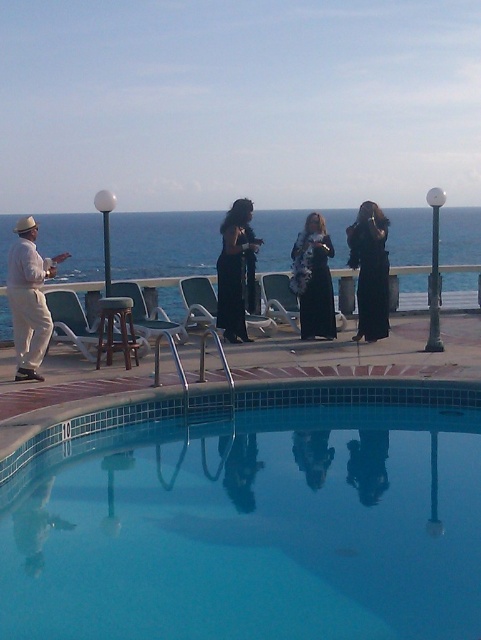
Is transparent glass pool at center positioned in front of black dress at center?

Yes, transparent glass pool at center is in front of black dress at center.

Can you confirm if transparent glass pool at center is positioned to the left of black dress at center?

Indeed, transparent glass pool at center is positioned on the left side of black dress at center.

Does point (60, 538) lie behind point (293, 275)?

That is False.

Identify the location of transparent glass pool at center. The width and height of the screenshot is (481, 640). (251, 516).

Between transparent glass water at center and black dress at center, which one has more height?

transparent glass water at center

This screenshot has width=481, height=640. What are the coordinates of `transparent glass water at center` in the screenshot? It's located at (164, 243).

You are a GUI agent. You are given a task and a screenshot of the screen. Output one action in this format:
    pyautogui.click(x=<x>, y=<y>)
    Task: Click on the white cotton shirt at left
    
    Given the screenshot: What is the action you would take?
    pyautogui.click(x=28, y=298)

Between point (23, 243) and point (270, 332), which one is positioned in front?

Positioned in front is point (23, 243).

Is point (27, 321) less distant than point (187, 323)?

Yes, point (27, 321) is closer to viewer.

You are a GUI agent. You are given a task and a screenshot of the screen. Output one action in this format:
    pyautogui.click(x=<x>, y=<y>)
    Task: Click on the white cotton shirt at left
    The width and height of the screenshot is (481, 640).
    Given the screenshot: What is the action you would take?
    pyautogui.click(x=28, y=298)